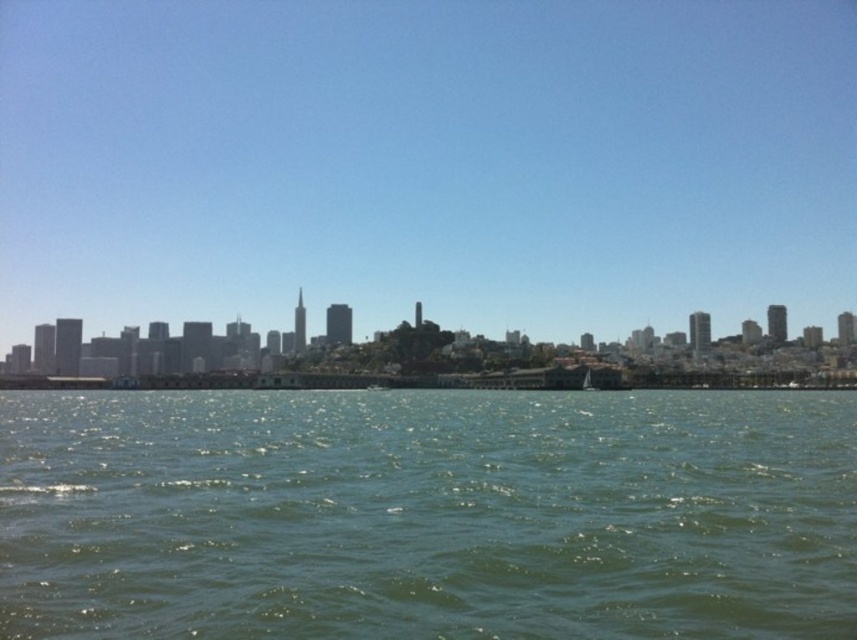
Identify the location of transparent glass skyline at center. Image resolution: width=857 pixels, height=640 pixels. (426, 161).

Is point (800, 97) closer to viewer compared to point (591, 381)?

No.

Locate an element on the screen. The width and height of the screenshot is (857, 640). transparent glass skyline at center is located at coordinates (426, 161).

From the picture: Who is more distant from viewer, (33, 26) or (196, 536)?

The point (33, 26) is behind.

Is point (748, 205) in front of point (739, 561)?

No.

Find the location of a particular element. transparent glass skyline at center is located at coordinates (426, 161).

The image size is (857, 640). Describe the element at coordinates (427, 515) in the screenshot. I see `green liquid water at lower center` at that location.

Between point (766, 520) and point (590, 374), which one is positioned in front?

Point (766, 520)

Locate an element on the screen. This screenshot has height=640, width=857. green liquid water at lower center is located at coordinates (427, 515).